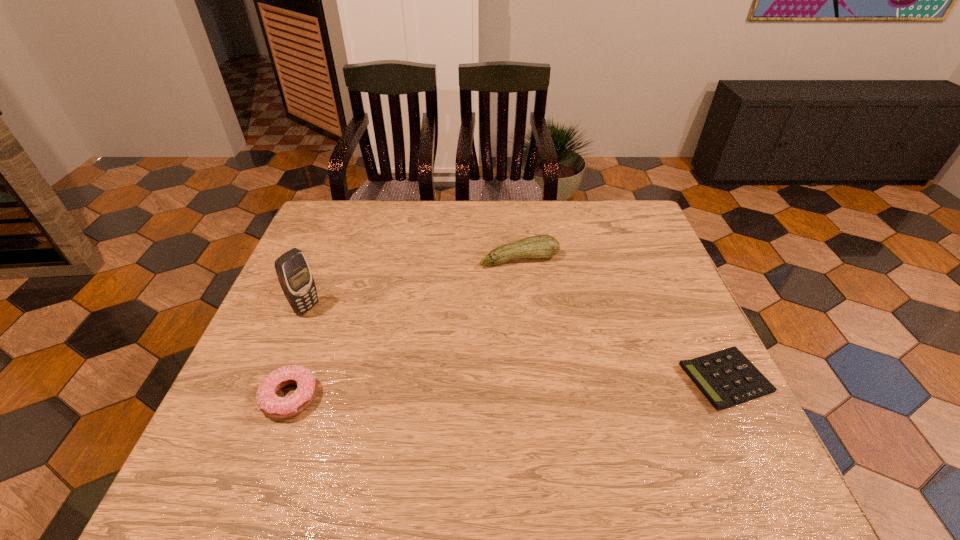
Where is `vacant space that's between the doughnut and the rightmost object`? vacant space that's between the doughnut and the rightmost object is located at coordinates (508, 388).

Where is `vacant region between the shortest object and the tallest object`? vacant region between the shortest object and the tallest object is located at coordinates (516, 343).

This screenshot has height=540, width=960. What are the coordinates of `empty space between the rightmost object and the second farthest object` in the screenshot? It's located at (516, 343).

Locate an element on the screen. This screenshot has height=540, width=960. free space between the second farthest object and the second tallest object is located at coordinates (413, 284).

Locate an element on the screen. The width and height of the screenshot is (960, 540). unoccupied area between the cellular telephone and the shortest object is located at coordinates (516, 343).

At what (x,y) coordinates should I click in order to perform the action: click on free space between the third shortest object and the rightmost object. Please return your answer as a coordinate pair (x, y). Looking at the image, I should click on (622, 319).

Where is `free space that is in between the tallest object and the calculator`? This screenshot has width=960, height=540. free space that is in between the tallest object and the calculator is located at coordinates (516, 343).

Identify the location of free spot between the farthest object and the second farthest object. (413, 284).

Image resolution: width=960 pixels, height=540 pixels. Find the location of `object that is the third nearest to the doughnut`. object that is the third nearest to the doughnut is located at coordinates (727, 378).

Locate which object is the closest to the zucchini. Please provide its 2D coordinates. Your answer should be formatted as a tuple, i.e. [(x, y)], where the tuple contains the x and y coordinates of a point satisfying the conditions above.

[(727, 378)]